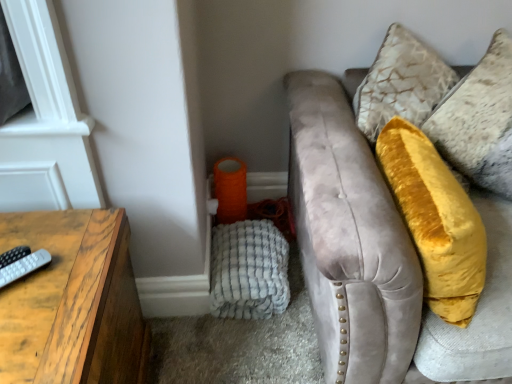
Locate an element on the screen. vacant area on top of wooden table at left (from a real-world perspective) is located at coordinates (47, 270).